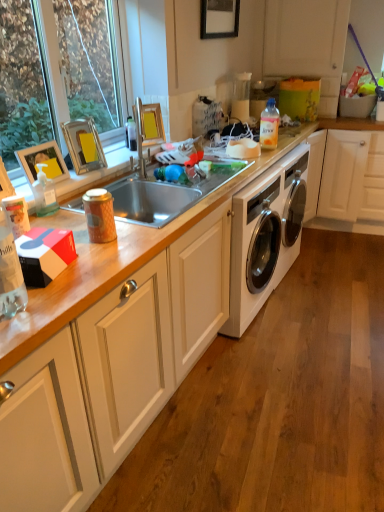
The width and height of the screenshot is (384, 512). I want to click on free space on the front side of silver metallic picture frame at upper left, the 3th picture frame from the top, so click(x=85, y=174).